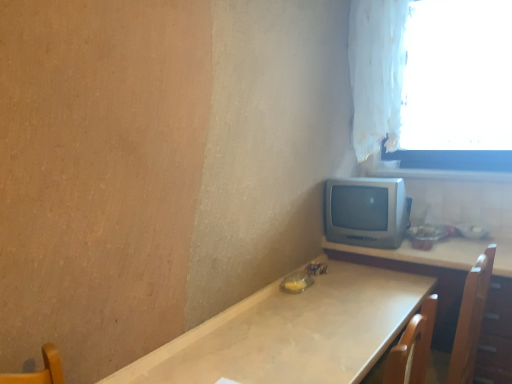
Locate an element on the screen. This screenshot has height=384, width=512. matte wooden table at right, which is the 1th table from right to left is located at coordinates (454, 292).

From the picture: Measure the distance between white fabric curtain at upper right and camera.

2.28 meters.

In order to click on matte white table at center, which appears as the second table when viewed from the right in this screenshot , I will do `click(292, 332)`.

From a real-world perspective, between matte wooden table at right, which is the 1th table from right to left, and silver metallic tv at center-right, who is vertically lower?

In real-world perspective, matte wooden table at right, which is the 1th table from right to left, is lower.

Which of these two, matte wooden table at right, which is the 2th table from left to right, or silver metallic tv at center-right, is wider?

matte wooden table at right, which is the 2th table from left to right, is wider.

Can you confirm if matte wooden table at right, which is the 1th table from right to left, is bigger than silver metallic tv at center-right?

Indeed, matte wooden table at right, which is the 1th table from right to left, has a larger size compared to silver metallic tv at center-right.

Is matte wooden table at right, which is the 1th table from right to left, at the left side of silver metallic tv at center-right?

Incorrect, matte wooden table at right, which is the 1th table from right to left, is not on the left side of silver metallic tv at center-right.

From the image's perspective, which object appears higher, matte white table at center, which appears as the second table when viewed from the right, or silver metallic tv at center-right?

silver metallic tv at center-right is shown above in the image.

Is matte white table at center, which ranks as the first table in left-to-right order, spatially inside silver metallic tv at center-right, or outside of it?

matte white table at center, which ranks as the first table in left-to-right order, cannot be found inside silver metallic tv at center-right.

From a real-world perspective, is matte white table at center, which ranks as the first table in left-to-right order, physically located above or below silver metallic tv at center-right?

matte white table at center, which ranks as the first table in left-to-right order, is below silver metallic tv at center-right.

Which object is positioned more to the left, matte white table at center, which ranks as the first table in left-to-right order, or silver metallic tv at center-right?

Positioned to the left is matte white table at center, which ranks as the first table in left-to-right order.

Does silver metallic tv at center-right lie behind white sheer curtain at upper right?

No, silver metallic tv at center-right is closer to the viewer.

Image resolution: width=512 pixels, height=384 pixels. Identify the location of window that appears on the right of silver metallic tv at center-right. (457, 87).

In terms of height, does silver metallic tv at center-right look taller or shorter compared to white sheer curtain at upper right?

Considering their sizes, silver metallic tv at center-right has less height than white sheer curtain at upper right.

From the image's perspective, which object appears higher, silver metallic tv at center-right or white sheer curtain at upper right?

white sheer curtain at upper right is shown above in the image.

Does matte wooden table at right, which is the 1th table from right to left, have a lesser width compared to white sheer curtain at upper right?

No, matte wooden table at right, which is the 1th table from right to left, is not thinner than white sheer curtain at upper right.

From a real-world perspective, who is located lower, matte wooden table at right, which is the 2th table from left to right, or white sheer curtain at upper right?

matte wooden table at right, which is the 2th table from left to right, from a real-world perspective.

From the image's perspective, is matte wooden table at right, which is the 2th table from left to right, on white sheer curtain at upper right?

Actually, matte wooden table at right, which is the 2th table from left to right, appears below white sheer curtain at upper right in the image.

Could you tell me if white sheer curtain at upper right is facing silver metallic tv at center-right?

Yes, white sheer curtain at upper right is aimed at silver metallic tv at center-right.

Is white sheer curtain at upper right beside silver metallic tv at center-right?

No.

From the image's perspective, is white sheer curtain at upper right on top of silver metallic tv at center-right?

Correct, white sheer curtain at upper right appears higher than silver metallic tv at center-right in the image.

Is white sheer curtain at upper right smaller than silver metallic tv at center-right?

Incorrect, white sheer curtain at upper right is not smaller in size than silver metallic tv at center-right.

What's the angular difference between silver metallic tv at center-right and white fabric curtain at upper right's facing directions?

The angular difference between silver metallic tv at center-right and white fabric curtain at upper right is 2.14 degrees.

Looking at this image, is silver metallic tv at center-right not close to white fabric curtain at upper right?

Actually, silver metallic tv at center-right and white fabric curtain at upper right are a little close together.

Which object is positioned more to the left, silver metallic tv at center-right or white fabric curtain at upper right?

silver metallic tv at center-right is more to the left.

Is silver metallic tv at center-right in front of or behind white fabric curtain at upper right in the image?

silver metallic tv at center-right is behind white fabric curtain at upper right.

Based on the photo, is white fabric curtain at upper right placed right next to white sheer curtain at upper right?

They are not placed beside each other.

Is white sheer curtain at upper right a part of white fabric curtain at upper right?

No, white sheer curtain at upper right is not surrounded by white fabric curtain at upper right.

Looking at this image, from the image's perspective, is white fabric curtain at upper right located above or below white sheer curtain at upper right?

white fabric curtain at upper right is situated higher than white sheer curtain at upper right in the image.

Find the location of a particular element. The image size is (512, 384). computer monitor that is above the matte wooden table at right, which is the 1th table from right to left (from a real-world perspective) is located at coordinates (366, 212).

Locate an element on the screen. This screenshot has height=384, width=512. computer monitor above the matte white table at center, which appears as the second table when viewed from the right (from the image's perspective) is located at coordinates (366, 212).

From the image, which object appears to be farther from white sheer curtain at upper right, matte white table at center, which appears as the second table when viewed from the right, or white fabric curtain at upper right?

matte white table at center, which appears as the second table when viewed from the right, is positioned further to the anchor white sheer curtain at upper right.

Looking at the image, which one is located closer to silver metallic tv at center-right, white fabric curtain at upper right or white sheer curtain at upper right?

white fabric curtain at upper right lies closer to silver metallic tv at center-right than the other object.

Based on their spatial positions, is matte wooden table at right, which is the 2th table from left to right, or white fabric curtain at upper right further from silver metallic tv at center-right?

white fabric curtain at upper right lies further to silver metallic tv at center-right than the other object.

When comparing their distances from matte wooden table at right, which is the 1th table from right to left, does white sheer curtain at upper right or white fabric curtain at upper right seem further?

white sheer curtain at upper right is positioned further to the anchor matte wooden table at right, which is the 1th table from right to left.

From the image, which object appears to be farther from white sheer curtain at upper right, matte wooden table at right, which is the 1th table from right to left, or white fabric curtain at upper right?

The object further to white sheer curtain at upper right is matte wooden table at right, which is the 1th table from right to left.

Considering their positions, is silver metallic tv at center-right positioned further to white fabric curtain at upper right than white sheer curtain at upper right?

silver metallic tv at center-right is positioned further to the anchor white fabric curtain at upper right.

From the image, which object appears to be farther from silver metallic tv at center-right, white sheer curtain at upper right or white fabric curtain at upper right?

white sheer curtain at upper right is further to silver metallic tv at center-right.

From the image, which object appears to be nearer to white sheer curtain at upper right, silver metallic tv at center-right or matte wooden table at right, which is the 2th table from left to right?

silver metallic tv at center-right.

I want to click on table between white sheer curtain at upper right and matte white table at center, which appears as the second table when viewed from the right, from top to bottom, so click(454, 292).

Find the location of a particular element. This screenshot has height=384, width=512. table located between matte white table at center, which ranks as the first table in left-to-right order, and silver metallic tv at center-right in the depth direction is located at coordinates (454, 292).

At what (x,y) coordinates should I click in order to perform the action: click on computer monitor between white sheer curtain at upper right and matte wooden table at right, which is the 1th table from right to left, from top to bottom. Please return your answer as a coordinate pair (x, y). The width and height of the screenshot is (512, 384). Looking at the image, I should click on (366, 212).

You are a GUI agent. You are given a task and a screenshot of the screen. Output one action in this format:
    pyautogui.click(x=<x>, y=<y>)
    Task: Click on the computer monitor that lies between white fabric curtain at upper right and matte wooden table at right, which is the 2th table from left to right, from top to bottom
    
    Given the screenshot: What is the action you would take?
    pyautogui.click(x=366, y=212)